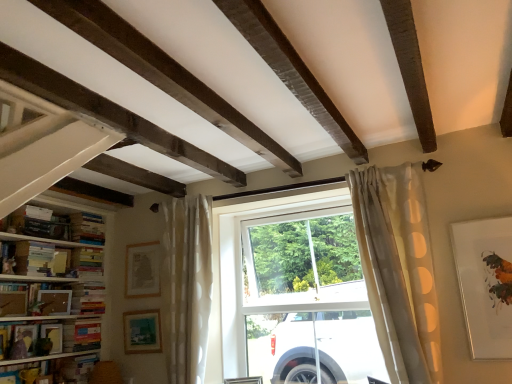
Question: Is matte white picture frame at upper right, arranged as the fifth picture frame when viewed from the left, taller or shorter than hardcover book at left, which is counted as the 2th book, starting from the bottom?

Choices:
 (A) tall
 (B) short

Answer: (A)

Question: From a real-world perspective, relative to hardcover book at left, which is counted as the 2th book, starting from the bottom, is matte white picture frame at upper right, arranged as the fifth picture frame when viewed from the left, vertically above or below?

Choices:
 (A) below
 (B) above

Answer: (B)

Question: Which is farther from the hardcover books at left, the 7th book positioned from the bottom?

Choices:
 (A) hardcover books at left, positioned as the eighth book in bottom-to-top order
 (B) matte wooden picture frame at lower left, the 2th picture frame positioned from the front
 (C) hardcover books at left, which is the 3th book in top-to-bottom order
 (D) hardcover books at left, placed as the 4th book when sorted from top to bottom
 (E) matte wooden picture frame at lower left, the 4th picture frame from the front

Answer: (E)

Question: Estimate the real-world distances between objects in this image. Which object is closer to the matte black bookshelf at lower left, which is the 4th book in bottom-to-top order?

Choices:
 (A) hardcover book at left, which appears as the 7th book when viewed from the top
 (B) hardcover books at left, placed as the 6th book when sorted from bottom to top
 (C) hardcover books at left, placed as the 4th book when sorted from top to bottom
 (D) hardcover books at left, positioned as the eighth book in bottom-to-top order
 (E) matte gold picture frame at center-left, the third picture frame in the right-to-left sequence

Answer: (A)